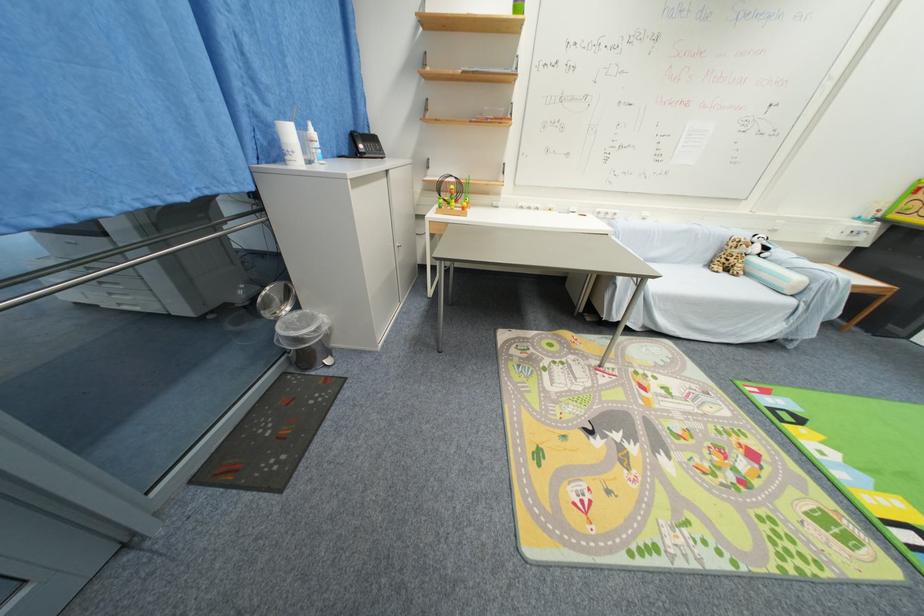
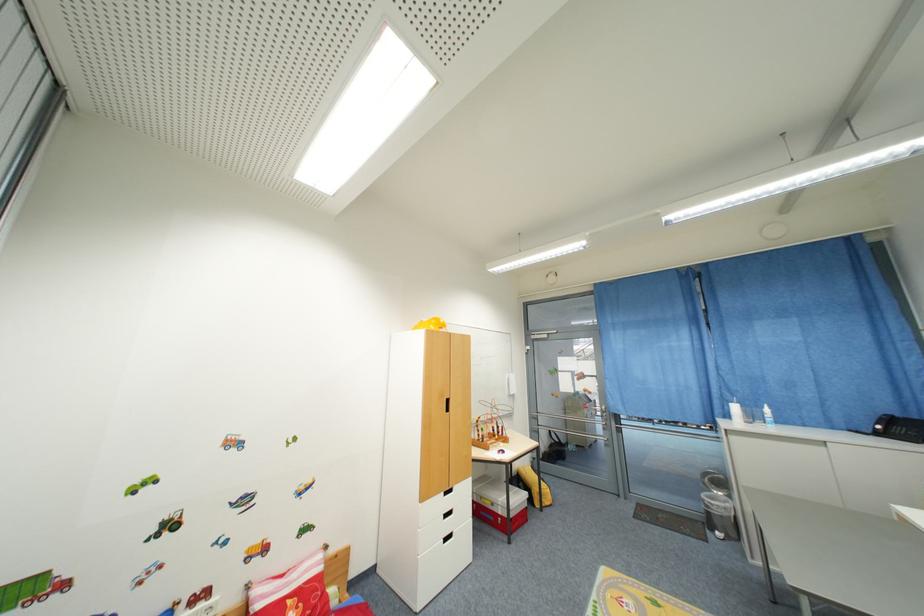
In the second image, find the point that corresponds to [294,135] in the first image.

(740, 410)